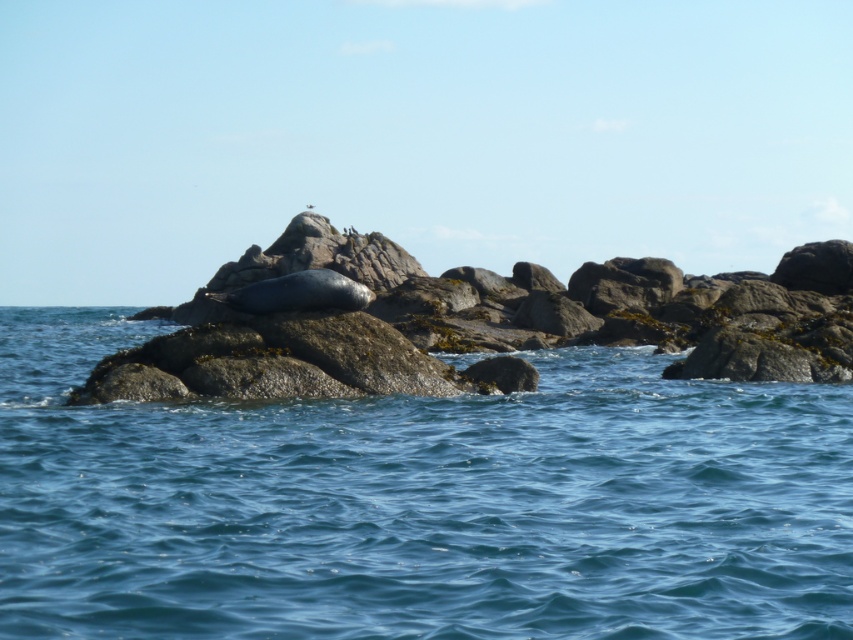
You are a marine biologist observing the coastal scene. You need to place a 10 feet long measurement tape between the smooth gray rock at center and the gray matte seal at center. Can you fit the entire tape between them without bending it?

The smooth gray rock at center and the gray matte seal at center are 23.89 feet apart, so yes, the 10 feet long measurement tape can fit between them without bending since the distance is greater than the tape length.

You are standing on the coast looking at the scene. There is a point marked at coordinates (418, 502). What is located at this point?

The point at coordinates (418, 502) marks blue water at center.

You are a photographer trying to capture the seal resting on the rock. Based on the scene, can you determine if the gray matte seal at center is positioned below or above the smooth gray rock at center?

The smooth gray rock at center is above the gray matte seal at center, so the seal is positioned below the rock.